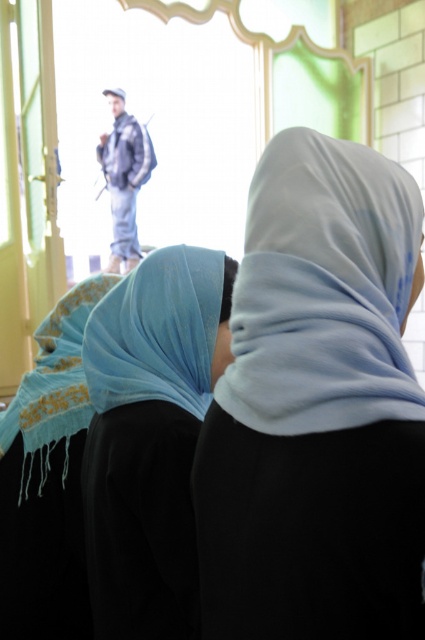
Please look at the point marked at coordinates (x=323, y=291). What object is located there?

The point at coordinates (x=323, y=291) indicates the light blue fabric scarf at upper center.

You are an interior designer planning to hang a decorative item between the light blue fabric scarf at upper center and the light blue sheer hijab at center. Which object should the item be placed above to maintain symmetry?

The decorative item should be placed above the light blue sheer hijab at center because the light blue fabric scarf at upper center is already positioned above it, so placing the new item above the lower object would help maintain symmetry.